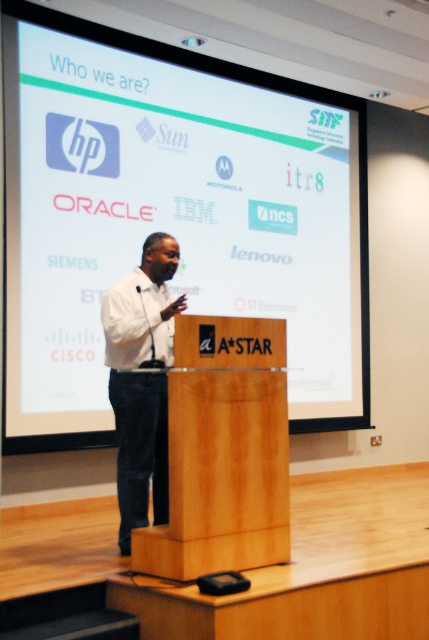
Between white matte projection screen at upper center and wooden podium at center, which one is positioned lower?

wooden podium at center is lower down.

Image resolution: width=429 pixels, height=640 pixels. I want to click on white matte projection screen at upper center, so click(172, 216).

Where is `white matte projection screen at upper center`? The image size is (429, 640). white matte projection screen at upper center is located at coordinates (172, 216).

Is white matte projection screen at upper center above white matte shirt at center?

Correct, white matte projection screen at upper center is located above white matte shirt at center.

Looking at this image, does white matte projection screen at upper center appear on the left side of white matte shirt at center?

In fact, white matte projection screen at upper center is to the right of white matte shirt at center.

Is point (79, 99) closer to viewer compared to point (121, 300)?

No, (79, 99) is further to viewer.

Locate an element on the screen. white matte projection screen at upper center is located at coordinates (172, 216).

The image size is (429, 640). What do you see at coordinates (223, 451) in the screenshot? I see `wooden podium at center` at bounding box center [223, 451].

Can you confirm if wooden podium at center is positioned to the left of white matte shirt at center?

Incorrect, wooden podium at center is not on the left side of white matte shirt at center.

Which is in front, point (256, 493) or point (166, 470)?

Positioned in front is point (256, 493).

This screenshot has height=640, width=429. Identify the location of wooden podium at center. (223, 451).